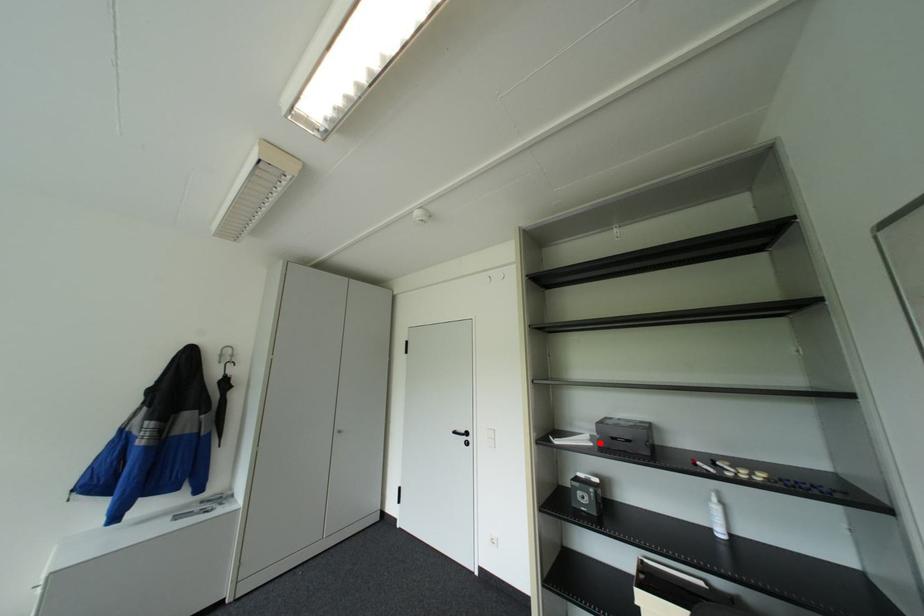
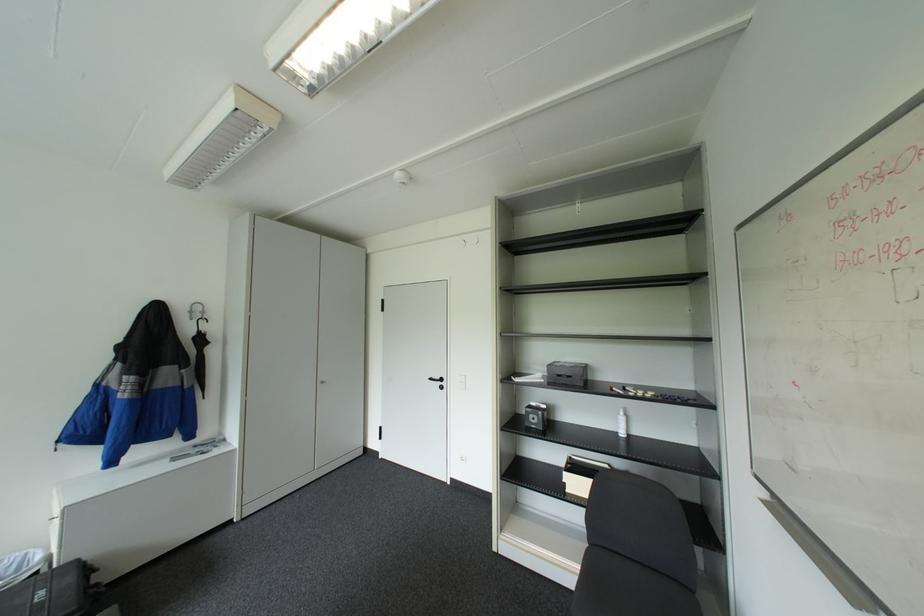
The point at the highlighted location is marked in the first image. Where is the corresponding point in the second image?

(551, 379)